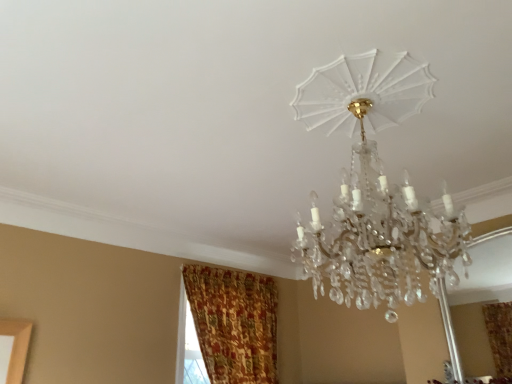
Identify the location of textured gold curtain at lower left. This screenshot has width=512, height=384. tap(234, 323).

This screenshot has height=384, width=512. What do you see at coordinates (234, 323) in the screenshot?
I see `textured gold curtain at lower left` at bounding box center [234, 323].

What is the approximate width of clear crystal chandelier at upper center?

It is 65.05 centimeters.

This screenshot has height=384, width=512. I want to click on clear crystal chandelier at upper center, so click(374, 190).

This screenshot has width=512, height=384. What do you see at coordinates (374, 190) in the screenshot?
I see `clear crystal chandelier at upper center` at bounding box center [374, 190].

Where is `textured gold curtain at lower left`? The image size is (512, 384). textured gold curtain at lower left is located at coordinates (234, 323).

Is clear crystal chandelier at upper center at the left side of textured gold curtain at lower left?

In fact, clear crystal chandelier at upper center is to the right of textured gold curtain at lower left.

Based on the photo, is clear crystal chandelier at upper center positioned before textured gold curtain at lower left?

That is True.

Does point (440, 224) lie behind point (265, 331)?

No, (440, 224) is in front of (265, 331).

From the image's perspective, is clear crystal chandelier at upper center under textured gold curtain at lower left?

No.

From a real-world perspective, which object rests below the other?

textured gold curtain at lower left is physically lower.

Which of these two, clear crystal chandelier at upper center or textured gold curtain at lower left, is wider?

clear crystal chandelier at upper center is wider.

Does clear crystal chandelier at upper center have a lesser height compared to textured gold curtain at lower left?

Correct, clear crystal chandelier at upper center is not as tall as textured gold curtain at lower left.

Does clear crystal chandelier at upper center have a larger size compared to textured gold curtain at lower left?

Correct, clear crystal chandelier at upper center is larger in size than textured gold curtain at lower left.

Is clear crystal chandelier at upper center positioned beyond the bounds of textured gold curtain at lower left?

Yes, clear crystal chandelier at upper center is not within textured gold curtain at lower left.

Looking at this image, would you consider clear crystal chandelier at upper center to be distant from textured gold curtain at lower left?

Indeed, clear crystal chandelier at upper center is not near textured gold curtain at lower left.

Is textured gold curtain at lower left at the back of clear crystal chandelier at upper center?

clear crystal chandelier at upper center is not turned away from textured gold curtain at lower left.

How many degrees apart are the facing directions of clear crystal chandelier at upper center and textured gold curtain at lower left?

The angular difference between clear crystal chandelier at upper center and textured gold curtain at lower left is 3.9 degrees.

Find the location of a particular element. lamp above the textured gold curtain at lower left (from a real-world perspective) is located at coordinates (374, 190).

Which is more to the left, textured gold curtain at lower left or clear crystal chandelier at upper center?

textured gold curtain at lower left is more to the left.

Relative to clear crystal chandelier at upper center, is textured gold curtain at lower left in front or behind?

Clearly, textured gold curtain at lower left is behind clear crystal chandelier at upper center.

Is point (222, 288) closer to camera compared to point (381, 264)?

No, (222, 288) is behind (381, 264).

From the image's perspective, is textured gold curtain at lower left located above or below clear crystal chandelier at upper center?

Clearly, from the image's perspective, textured gold curtain at lower left is below clear crystal chandelier at upper center.

Consider the image. From a real-world perspective, which is physically below, textured gold curtain at lower left or clear crystal chandelier at upper center?

textured gold curtain at lower left is physically lower.

Does textured gold curtain at lower left have a greater width compared to clear crystal chandelier at upper center?

No.

From their relative heights in the image, would you say textured gold curtain at lower left is taller or shorter than clear crystal chandelier at upper center?

Considering their sizes, textured gold curtain at lower left has more height than clear crystal chandelier at upper center.

Considering the relative sizes of textured gold curtain at lower left and clear crystal chandelier at upper center in the image provided, is textured gold curtain at lower left bigger than clear crystal chandelier at upper center?

No, textured gold curtain at lower left is not bigger than clear crystal chandelier at upper center.

Do you think textured gold curtain at lower left is within clear crystal chandelier at upper center, or outside of it?

textured gold curtain at lower left is not inside clear crystal chandelier at upper center, it's outside.

Is textured gold curtain at lower left not close to clear crystal chandelier at upper center?

textured gold curtain at lower left is positioned a significant distance from clear crystal chandelier at upper center.

Looking at this image, could you tell me if textured gold curtain at lower left is turned towards clear crystal chandelier at upper center?

Yes, textured gold curtain at lower left is aimed at clear crystal chandelier at upper center.

Find the location of a particular element. curtain on the left side of clear crystal chandelier at upper center is located at coordinates (234, 323).

The width and height of the screenshot is (512, 384). Find the location of `curtain that appears on the left of clear crystal chandelier at upper center`. curtain that appears on the left of clear crystal chandelier at upper center is located at coordinates (234, 323).

This screenshot has height=384, width=512. I want to click on lamp above the textured gold curtain at lower left (from the image's perspective), so click(x=374, y=190).